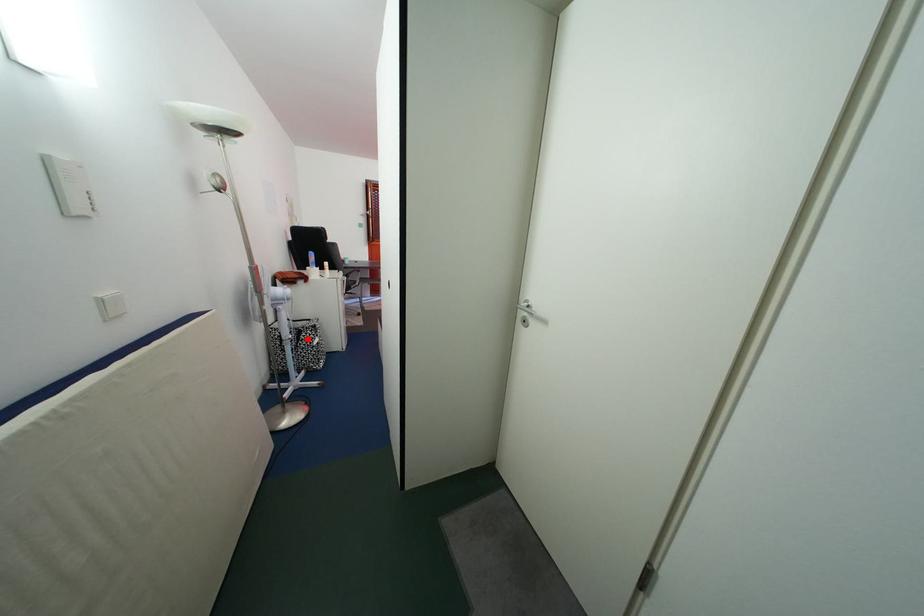
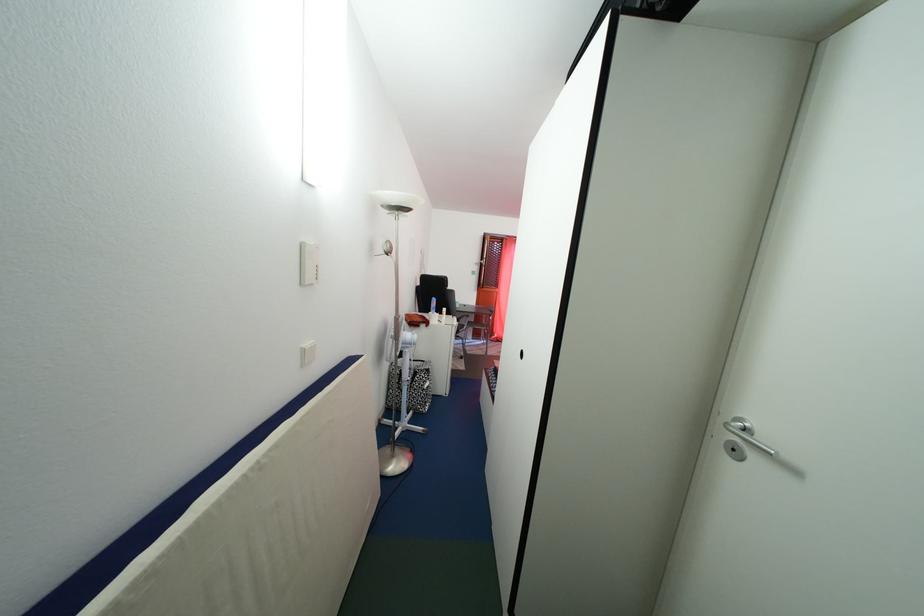
Question: I am providing you with two images of the same scene from different viewpoints. In image1, a red point is highlighted. Considering the same 3D point in image2, which of the following is correct?

Choices:
 (A) It is closer
 (B) It is farther

Answer: (B)